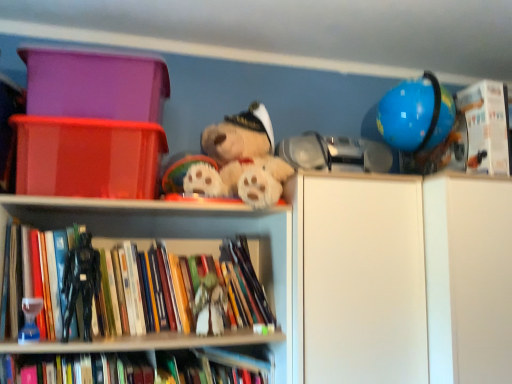
Question: From a real-world perspective, relative to matte plastic storage box at upper left, which ranks as the first storage box in top-to-bottom order, is hardcover books at left, which ranks as the third book in right-to-left order, vertically above or below?

Choices:
 (A) below
 (B) above

Answer: (A)

Question: In the image, is hardcover books at left, which appears as the 1th book when viewed from the left, positioned in front of or behind matte plastic storage box at upper left, which ranks as the first storage box in top-to-bottom order?

Choices:
 (A) behind
 (B) front

Answer: (B)

Question: Which of these objects is positioned farthest from the white matte cabinet at right?

Choices:
 (A) black matte figurine at left
 (B) matte plastic storage box at upper left, which is the second storage box from bottom to top
 (C) hardcover book at center, positioned as the 3th book in top-to-bottom order
 (D) white matte figurine at center, positioned as the first toy in back-to-front order
 (E) red plastic storage box at left, which is the 1th storage box in bottom-to-top order

Answer: (A)

Question: Which object is the farthest from the black matte figurine at left?

Choices:
 (A) translucent glass hourglass at lower left, the second toy when ordered from back to front
 (B) white matte cabinet at right
 (C) hardcover book at center, positioned as the second book in right-to-left order
 (D) white cardboard box at upper right, acting as the first book starting from the top
 (E) hardcover books at left, marked as the 2th book in a top-to-bottom arrangement

Answer: (D)